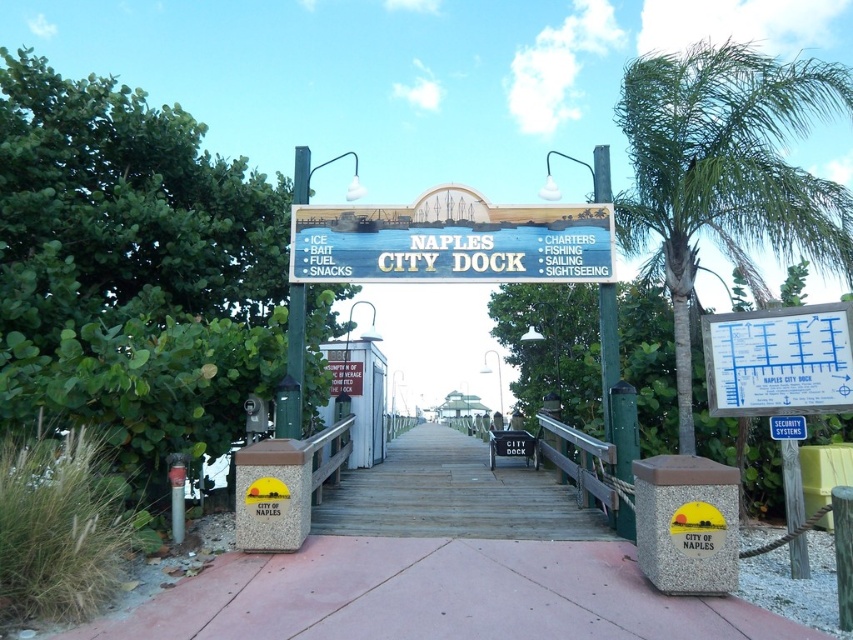
Question: Among these points, which one is nearest to the camera?

Choices:
 (A) (753, 365)
 (B) (296, 422)
 (C) (602, 620)
 (D) (517, 464)

Answer: (C)

Question: Is green leafy palm tree at right positioned behind wooden signboard at center?

Choices:
 (A) yes
 (B) no

Answer: (B)

Question: Does wooden dock at center have a greater width compared to metallic signpost at center?

Choices:
 (A) yes
 (B) no

Answer: (A)

Question: Which point appears farthest from the camera in this image?

Choices:
 (A) (608, 406)
 (B) (437, 604)
 (C) (299, 397)
 (D) (827, 365)

Answer: (C)

Question: Among these objects, which one is nearest to the camera?

Choices:
 (A) metallic signpost at center
 (B) wooden dock at center

Answer: (B)

Question: Where is metallic signpost at center located in relation to green wooden signpost at center in the image?

Choices:
 (A) below
 (B) above

Answer: (B)